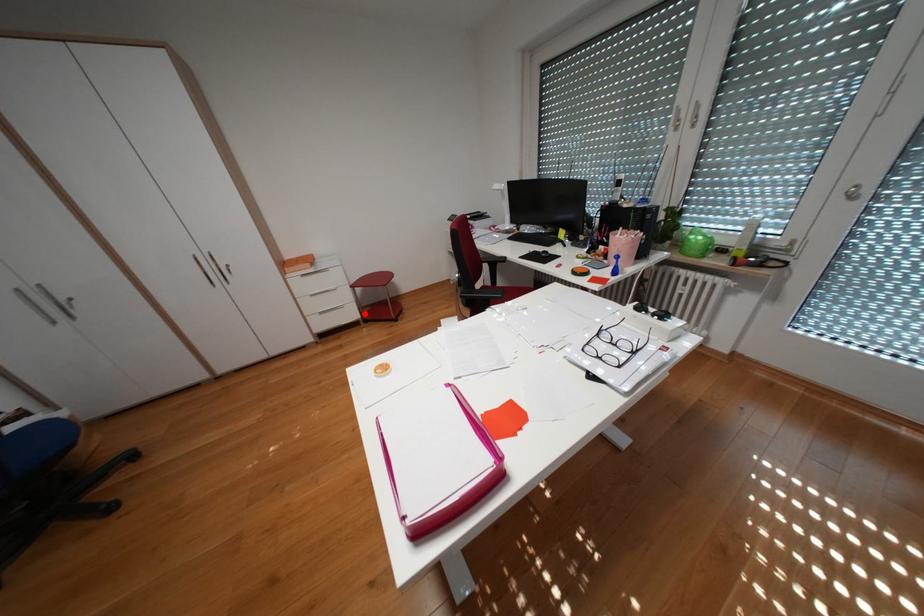
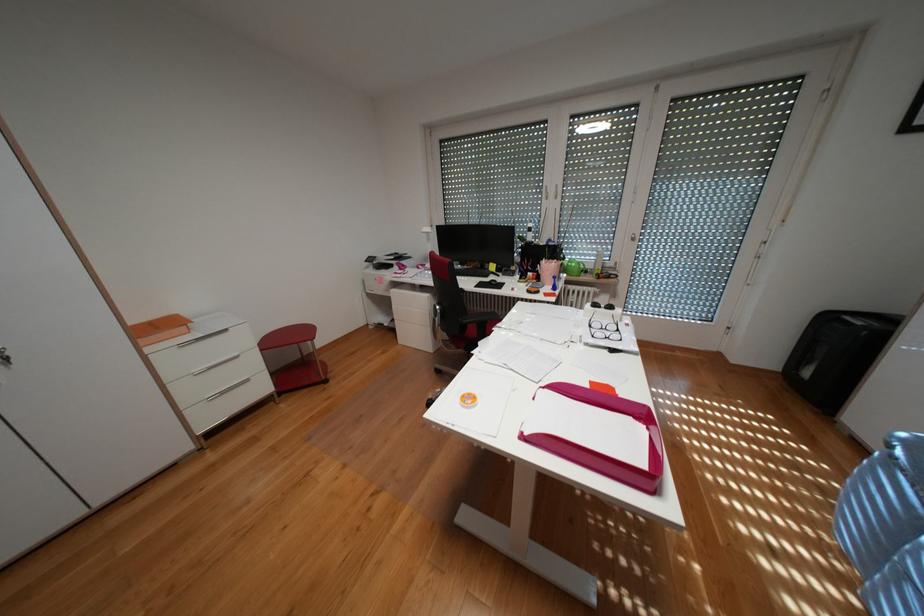
Locate, in the second image, the point that corresponds to the highlighted location in the first image.

(274, 387)